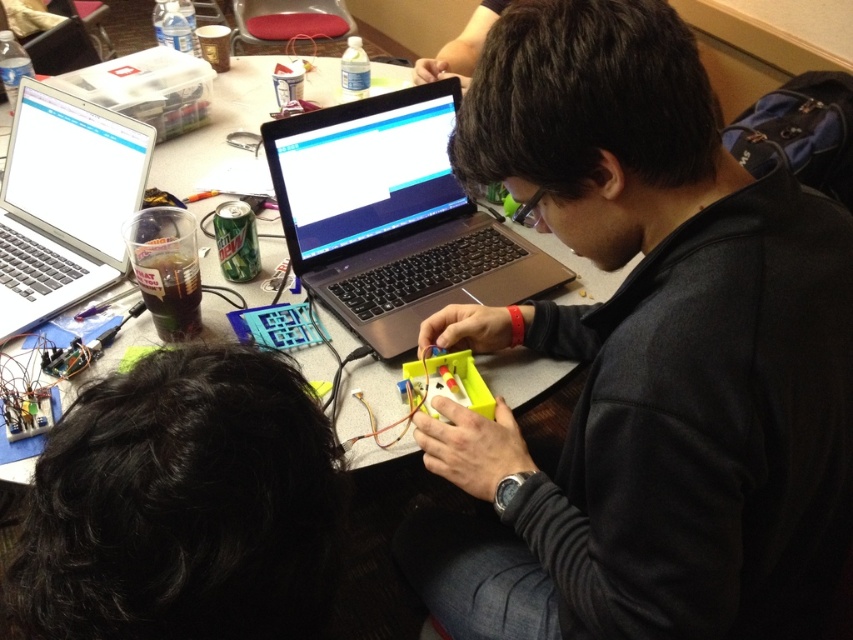
Question: Which point is farther to the camera?

Choices:
 (A) (599, 102)
 (B) (268, 435)

Answer: (A)

Question: Is black matte laptop at center above matte plastic table at center?

Choices:
 (A) no
 (B) yes

Answer: (A)

Question: Which point is farther to the camera?

Choices:
 (A) (833, 253)
 (B) (61, 212)
 (C) (350, 397)

Answer: (B)

Question: In this image, where is black hair at upper center located relative to silver metallic laptop at center?

Choices:
 (A) left
 (B) right

Answer: (A)

Question: Which point appears farthest from the camera in this image?

Choices:
 (A) (61, 284)
 (B) (207, 147)
 (C) (718, 282)
 (D) (495, 301)

Answer: (B)

Question: Is black matte laptop at center bigger than matte plastic table at center?

Choices:
 (A) yes
 (B) no

Answer: (B)